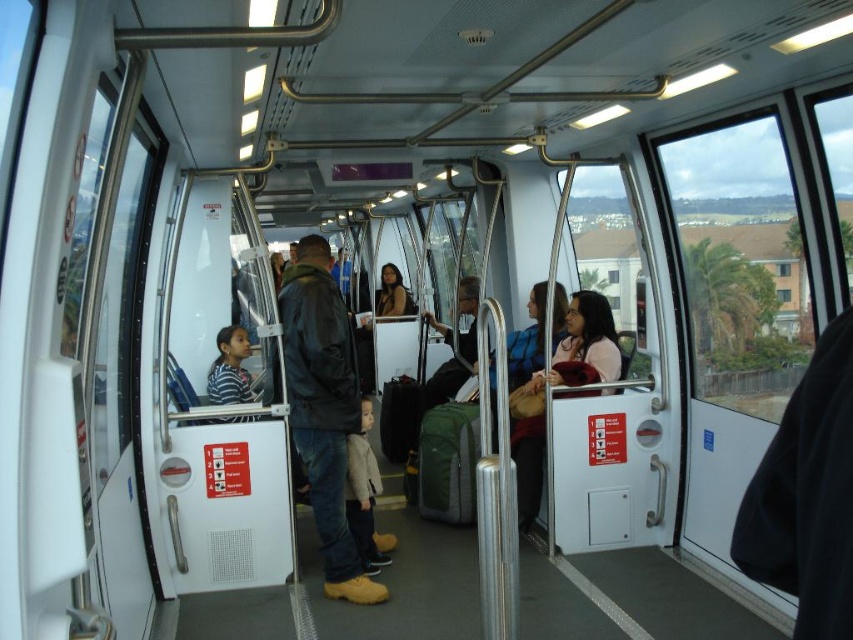
Question: Which point is farther from the camera taking this photo?

Choices:
 (A) (350, 522)
 (B) (320, 541)

Answer: (B)

Question: Is the position of leather jacket at center more distant than that of light beige sweater at center?

Choices:
 (A) yes
 (B) no

Answer: (B)

Question: Considering the relative positions of leather jacket at center and light beige sweater at center in the image provided, where is leather jacket at center located with respect to light beige sweater at center?

Choices:
 (A) left
 (B) right

Answer: (A)

Question: Is leather jacket at center closer to the viewer compared to light beige sweater at center?

Choices:
 (A) yes
 (B) no

Answer: (A)

Question: Which of the following is the closest to the observer?

Choices:
 (A) (329, 477)
 (B) (368, 484)

Answer: (A)